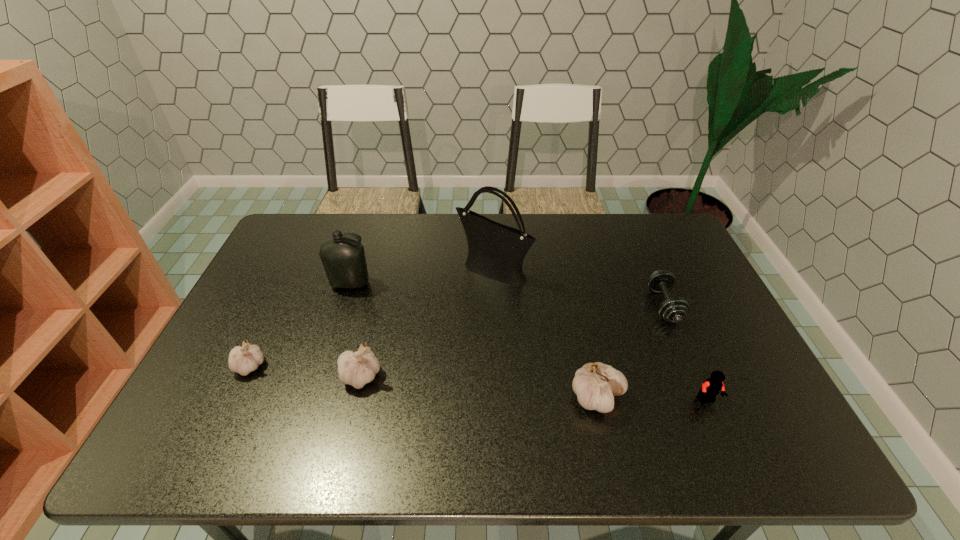
Identify which object is located as the sixth nearest to the bottle. Please provide its 2D coordinates. Your answer should be formatted as a tuple, i.e. [(x, y)], where the tuple contains the x and y coordinates of a point satisfying the conditions above.

[(712, 386)]

Select which garlic is the second closest to the fourth object from left to right. Please provide its 2D coordinates. Your answer should be formatted as a tuple, i.e. [(x, y)], where the tuple contains the x and y coordinates of a point satisfying the conditions above.

[(595, 384)]

Select which garlic appears as the second closest to the fifth object from left to right. Please provide its 2D coordinates. Your answer should be formatted as a tuple, i.e. [(x, y)], where the tuple contains the x and y coordinates of a point satisfying the conditions above.

[(243, 360)]

Where is `vacant space that satisfies the following two spatial constraints: 1. on the front side of the fourth tallest object; 2. on the left side of the shortest garlic`? This screenshot has width=960, height=540. vacant space that satisfies the following two spatial constraints: 1. on the front side of the fourth tallest object; 2. on the left side of the shortest garlic is located at coordinates (245, 376).

Locate an element on the screen. vacant space that satisfies the following two spatial constraints: 1. on the front side of the shortest object; 2. on the left side of the sixth shortest object is located at coordinates (344, 306).

The image size is (960, 540). Identify the location of free space in the image that satisfies the following two spatial constraints: 1. on the front side of the fifth object from left to right; 2. on the right side of the second tallest object. (314, 397).